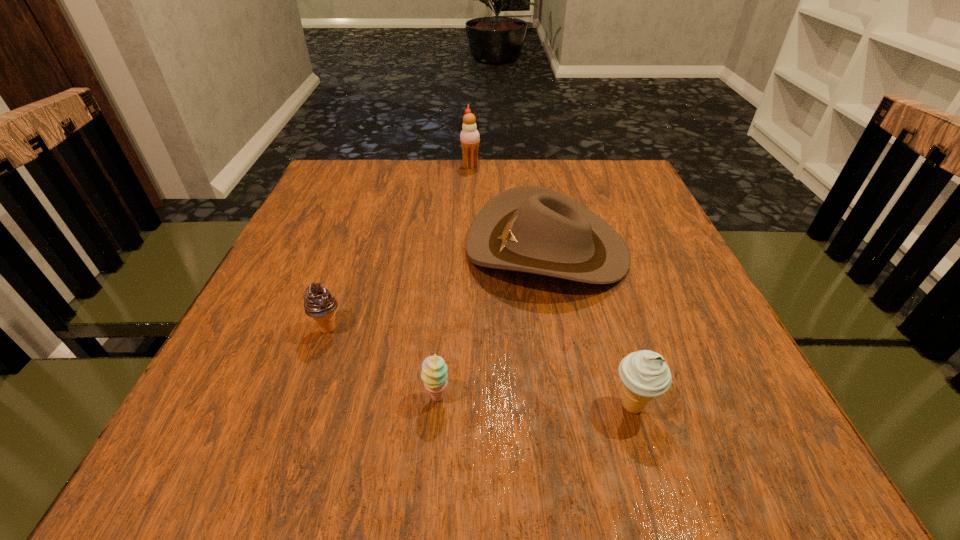
Where is `the farthest object`? the farthest object is located at coordinates (469, 137).

In order to click on the farthest icecream in this screenshot , I will do `click(469, 137)`.

At what (x,y) coordinates should I click in order to perform the action: click on the fourth nearest object. Please return your answer as a coordinate pair (x, y). This screenshot has width=960, height=540. Looking at the image, I should click on (531, 229).

Locate an element on the screen. This screenshot has height=540, width=960. the rightmost icecream is located at coordinates (645, 374).

Find the location of a particular element. the third nearest object is located at coordinates (319, 304).

This screenshot has width=960, height=540. I want to click on the leftmost icecream, so click(319, 304).

Find the location of `sherbert`. sherbert is located at coordinates (434, 374).

Locate an element on the screen. This screenshot has width=960, height=540. vacant space situated 0.110m at the front with a straw on the tallest icecream is located at coordinates (519, 166).

What are the coordinates of `free space located 0.080m with a star on the front of the second farthest object` in the screenshot? It's located at (429, 249).

Where is `free space located 0.250m with a star on the front of the second farthest object`? Image resolution: width=960 pixels, height=540 pixels. free space located 0.250m with a star on the front of the second farthest object is located at coordinates (350, 249).